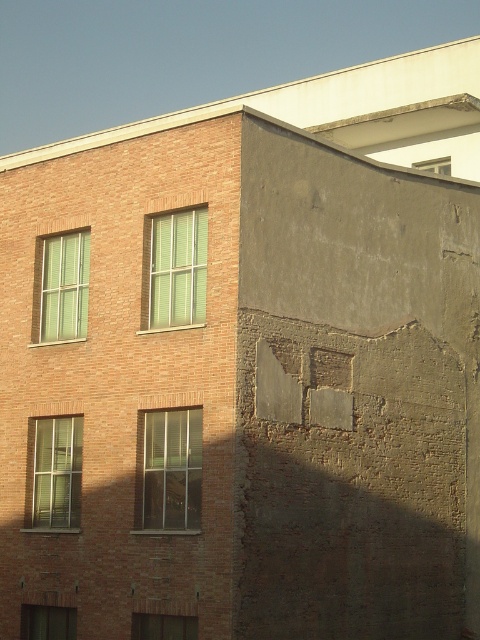
You are standing in front of the building with reddish brown bricks and want to see the modern dark gray concrete wall on the right. Which direction should you turn to look through the clear glass window at center?

You should turn to your right to look through the clear glass window at center, as it is positioned at point (171, 468) which is to the right of the reddish brown brick building.

You are an architect comparing two windows in a building design. The green matte window at upper left and the clear glass window at upper right are part of the design. Which window has a greater width?

The green matte window at upper left has a greater width than the clear glass window at upper right.